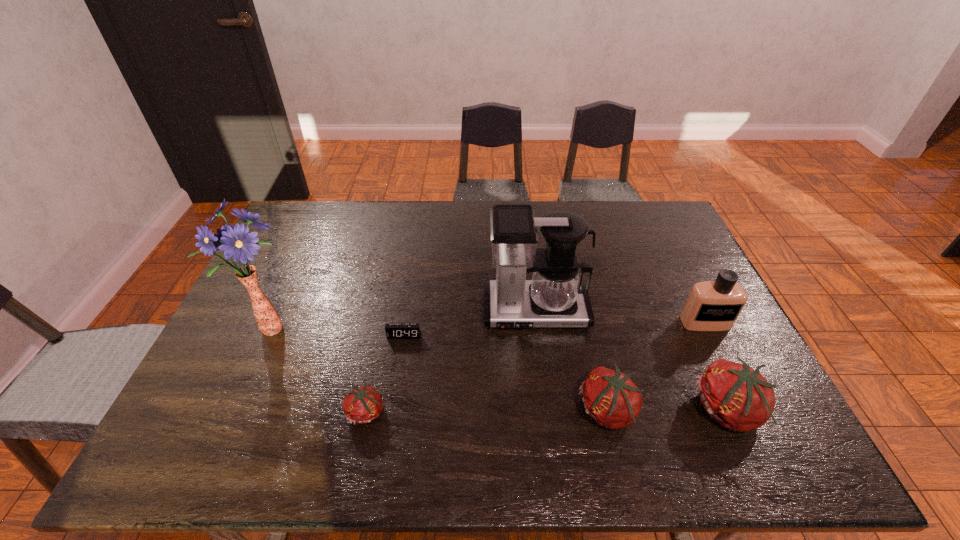
You are a GUI agent. You are given a task and a screenshot of the screen. Output one action in this format:
    pyautogui.click(x=<x>, y=<y>)
    Task: Click on the free space located on the back of the second shortest object
    Image resolution: width=960 pixels, height=540 pixels.
    Given the screenshot: What is the action you would take?
    pyautogui.click(x=388, y=313)

What are the coordinates of `vacant space located on the left of the second tomato from left to right` in the screenshot? It's located at (557, 411).

Locate an element on the screen. The image size is (960, 540). free space located 0.050m on the back of the rightmost tomato is located at coordinates (706, 363).

The image size is (960, 540). Identify the location of vacant space located at the front of the coffee maker where the controls are located. (540, 355).

Identify the location of free space located 0.190m on the back of the leftmost object. The image size is (960, 540). (298, 268).

Locate an element on the screen. This screenshot has height=540, width=960. free point located 0.090m on the front-facing side of the alarm clock is located at coordinates (399, 366).

In order to click on blank area located 0.050m on the front label of the perfume in this screenshot , I will do `click(716, 346)`.

Where is `object present at the left edge`? The width and height of the screenshot is (960, 540). object present at the left edge is located at coordinates (235, 241).

Where is `tomato located at the right edge`? The height and width of the screenshot is (540, 960). tomato located at the right edge is located at coordinates pos(738,397).

Locate an element on the screen. Image resolution: width=960 pixels, height=540 pixels. perfume present at the right edge is located at coordinates (711, 305).